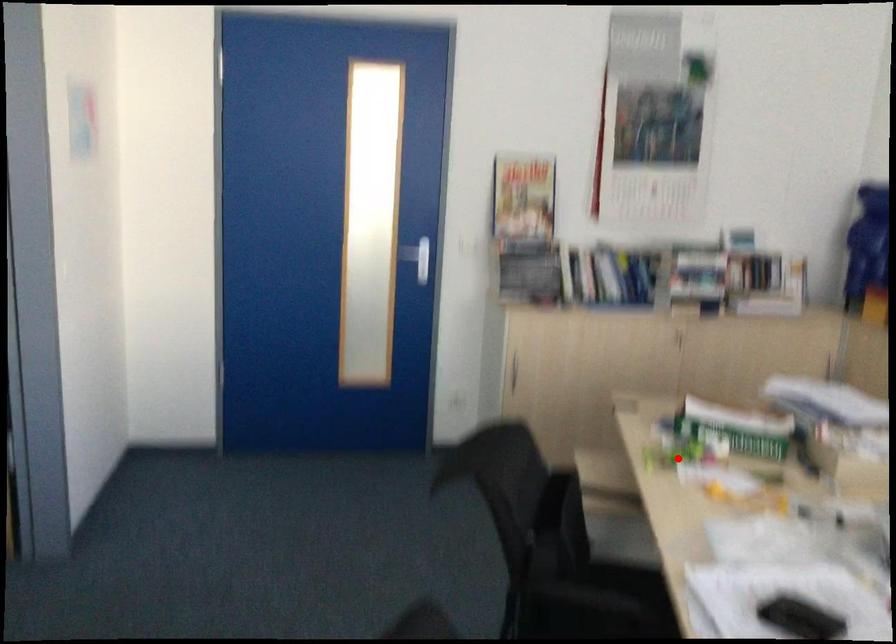
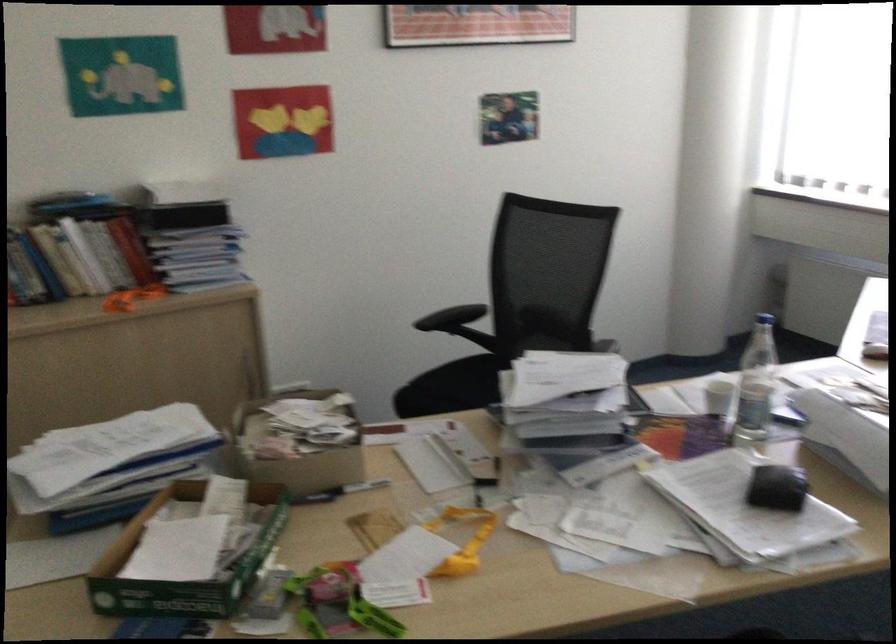
Question: I am providing you with two images of the same scene from different viewpoints. In image1, a red point is highlighted. Considering the same 3D point in image2, which of the following is correct?

Choices:
 (A) It is closer
 (B) It is farther

Answer: (A)